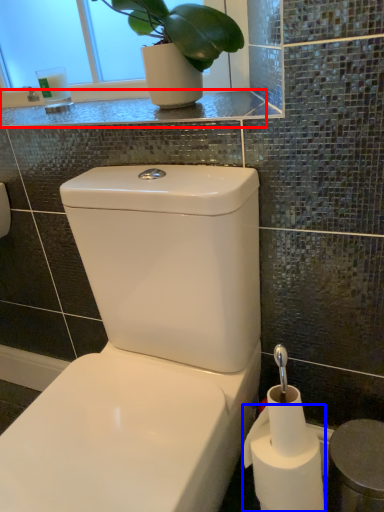
Question: Which object appears farthest to the camera in this image, counter top (highlighted by a red box) or toilet paper (highlighted by a blue box)?

Choices:
 (A) counter top
 (B) toilet paper

Answer: (A)